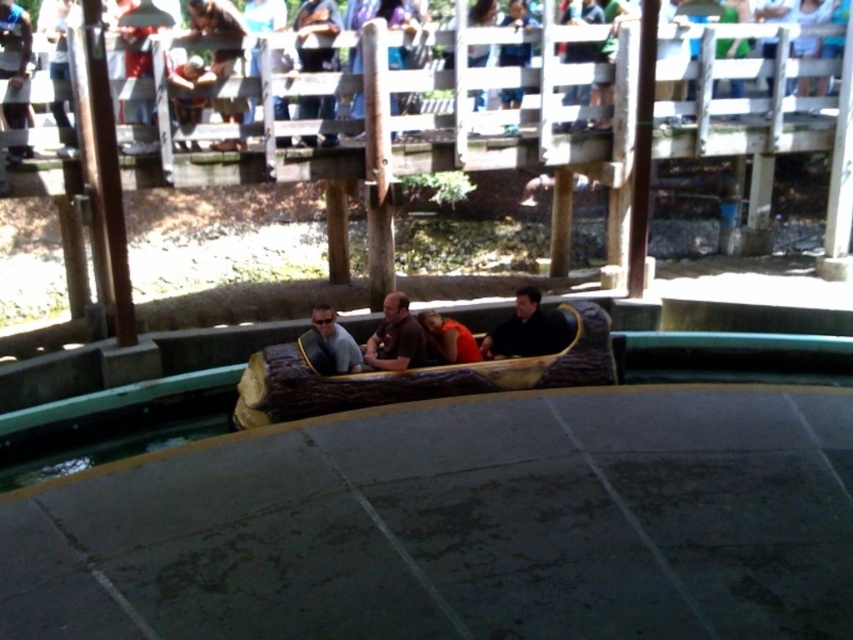
You are a guest at the amusement park and want to know where the brown leather jacket at center is located relative to the orange fabric at center in the log flume boat. Could you describe their positions?

The brown leather jacket at center is positioned on the left side of orange fabric at center.